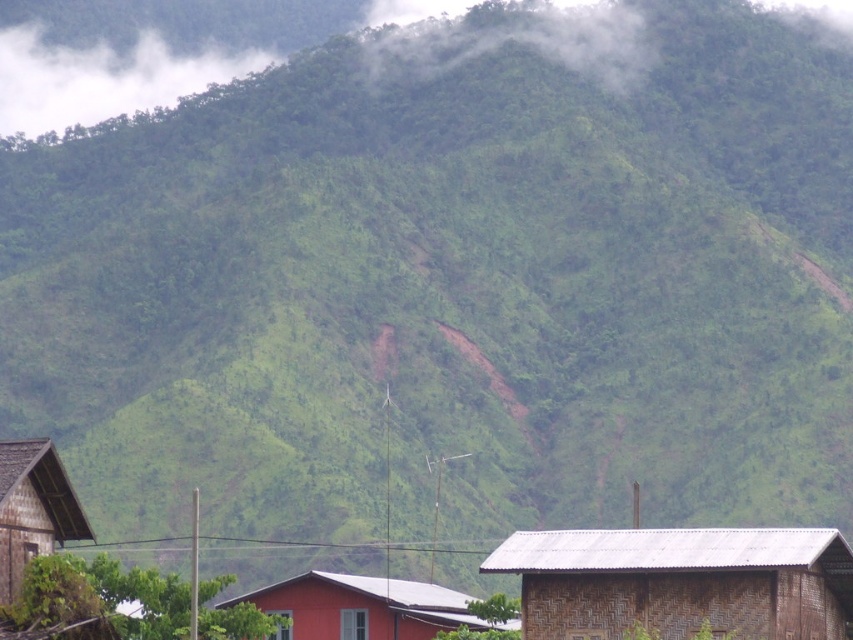
Question: Which point is farther from the camera taking this photo?

Choices:
 (A) (744, 636)
 (B) (111, 108)
 (C) (335, 595)

Answer: (B)

Question: Does white fog at upper left appear on the right side of white foggy cloud at upper center?

Choices:
 (A) yes
 (B) no

Answer: (B)

Question: Does white foggy cloud at upper center have a lesser width compared to wooden hut at lower left?

Choices:
 (A) no
 (B) yes

Answer: (A)

Question: Which of the following is the farthest from the observer?

Choices:
 (A) wooden hut at lower left
 (B) matte red hut at center
 (C) brown woven hut at lower right
 (D) white fog at upper left

Answer: (D)

Question: Among these points, which one is nearest to the camera?

Choices:
 (A) (577, 29)
 (B) (9, 547)
 (C) (300, 586)

Answer: (B)

Question: Does brown woven hut at lower right have a larger size compared to wooden hut at lower left?

Choices:
 (A) no
 (B) yes

Answer: (B)